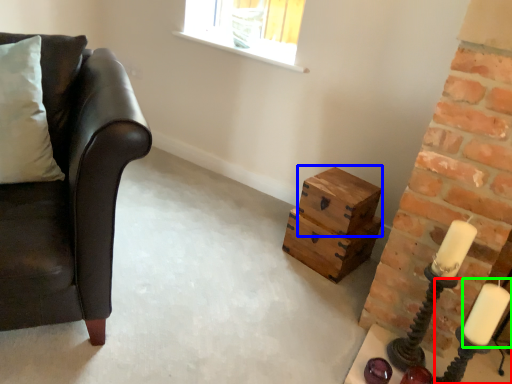
Question: Which is nearer to the candle holder (highlighted by a red box)? box (highlighted by a blue box) or candle (highlighted by a green box).

Choices:
 (A) box
 (B) candle

Answer: (B)